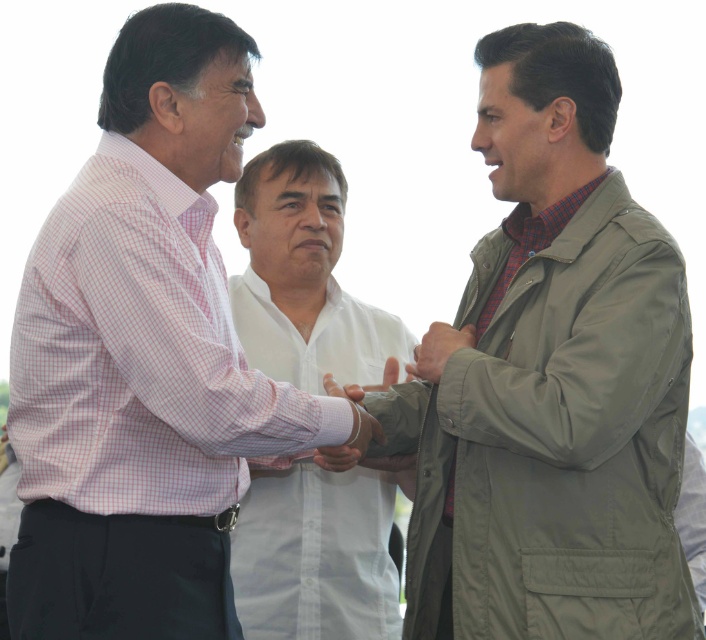
You are a photographer trying to capture a candid shot of the olive green fabric trench coat at center and the pink checkered shirt at left. Since you want the trench coat to be in focus, where should you position the camera relative to the shirt?

The olive green fabric trench coat at center is located below the pink checkered shirt at left, so you should position the camera lower to focus on the trench coat at center while still including the pink checkered shirt at left in the frame.

You are a photographer trying to capture a group photo of the three people in the scene. You want to ensure that the olive green fabric trench coat at center and the pink checkered shirt at left are both visible in the frame. Based on their positions, which direction should you position yourself relative to the group to include both objects in the shot?

Since the olive green fabric trench coat at center is to the right of the pink checkered shirt at left, you should position yourself to the left side of the group to ensure both objects are visible in the frame.

Looking at this image, you are a photographer trying to capture a candid shot of the two individuals shaking hands. You notice there are two items at the center of the image. Which one is shorter between the olive green fabric trench coat at center and the white cotton shirt at center?

The olive green fabric trench coat at center is shorter than the white cotton shirt at center.